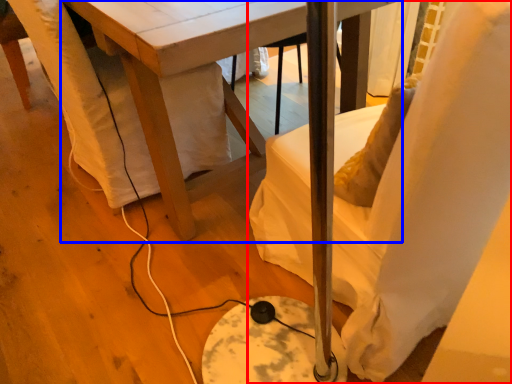
Question: Which object is closer to the camera taking this photo, chair (highlighted by a red box) or table (highlighted by a blue box)?

Choices:
 (A) chair
 (B) table

Answer: (A)